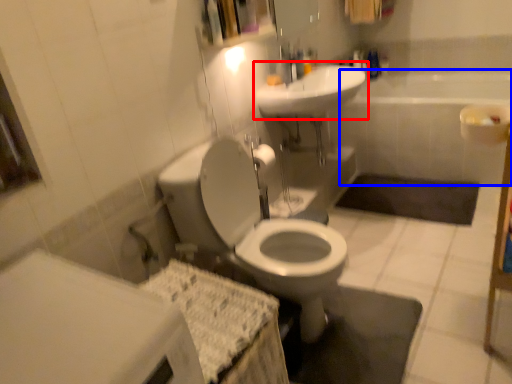
Question: Which point is closer to the camera, sink (highlighted by a red box) or bath (highlighted by a blue box)?

Choices:
 (A) sink
 (B) bath

Answer: (A)